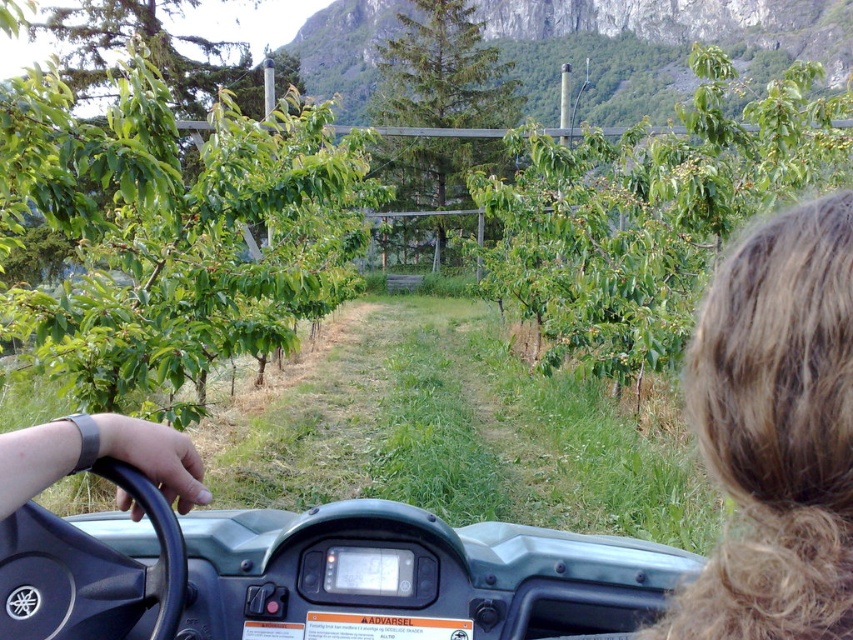
You are a passenger in the UTV and notice the green leafy tree at center and the blonde hair at upper right. Which object is located to the right of the other?

The green leafy tree at center is positioned on the right side of blonde hair at upper right.

You are a passenger in the UTV and need to reach the gray rubber wristband at lower left without touching the blonde hair at upper right. Is this possible?

The blonde hair at upper right is much taller than the gray rubber wristband at lower left, so you can reach the gray rubber wristband at lower left without touching the blonde hair at upper right.

From the picture: You are a passenger in the UTV and want to take a photo of the driver using a camera. The driver has blonde hair at upper right. Can you reach the camera from your current position to take the photo?

The distance between the blonde hair at upper right and the camera is 24.71 inches, so yes, you can reach the camera from your current position to take the photo.